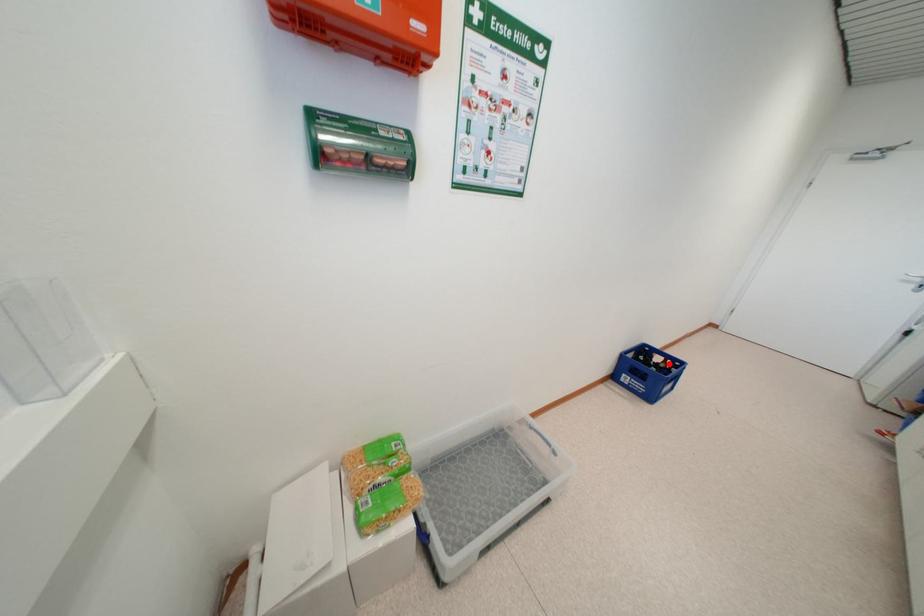
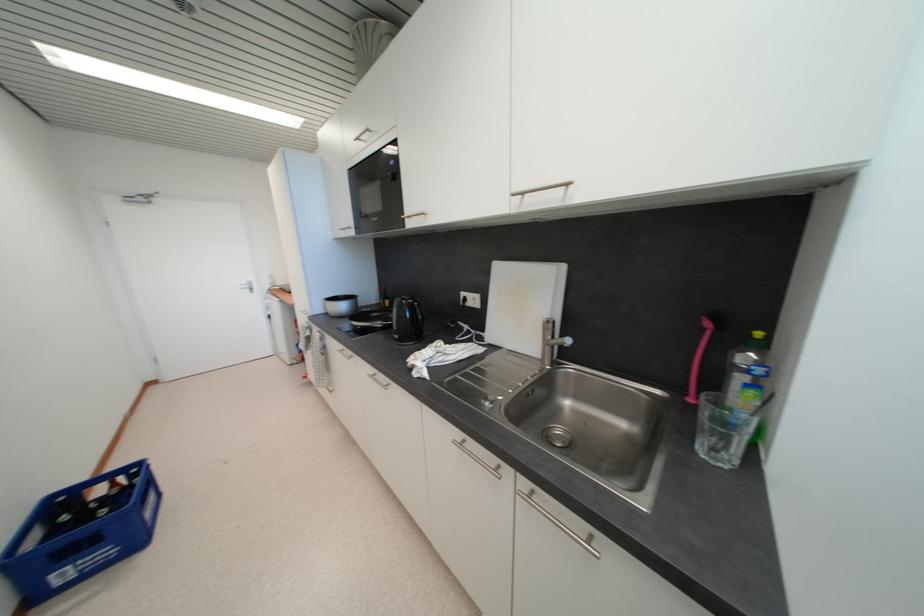
The point at the highlighted location is marked in the first image. Where is the corresponding point in the second image?

(118, 487)